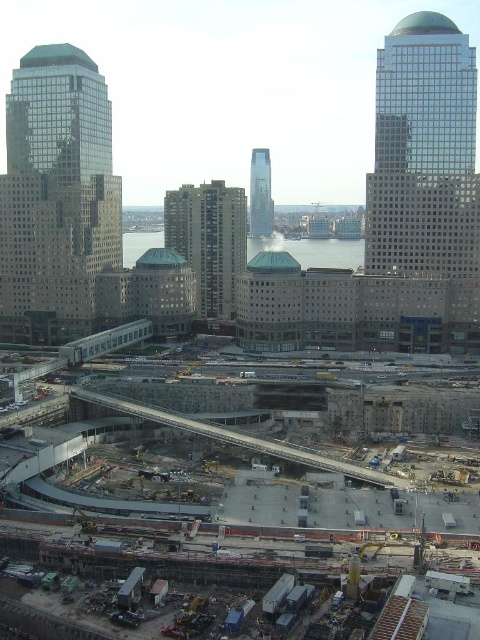
You are a construction worker standing at the edge of the curved walkway in the foreground. You need to place a heavy object on the concrete at center and the gray concrete train track at center. Which location should you choose if you want the object to be closer to the reflective glass buildings in the midground?

The concrete at center is closer to the viewer than the gray concrete train track at center, so placing the object there would make it closer to the reflective glass buildings in the midground.

You are a construction worker standing at the point marked as point (84, 451). Looking around, you see the curved walkway and the modern buildings with green domes. Which direction should you move to reach the nearest solid ground?

The point (84, 451) is on concrete at center, so moving towards the curved walkway or the modern buildings with green domes would lead to solid ground since they are part of the construction site infrastructure.